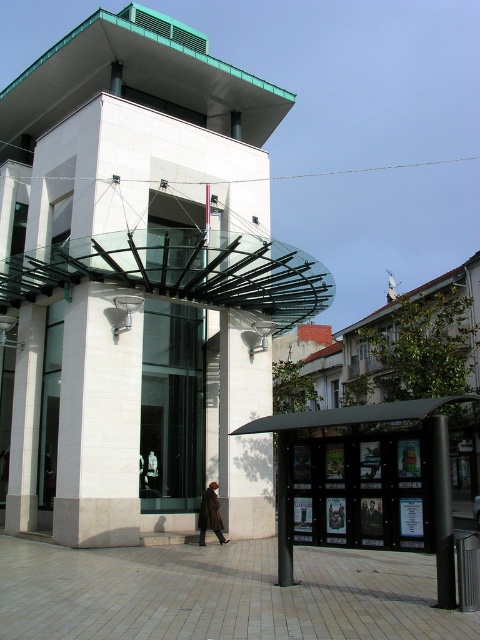
Question: Does white stone bell tower at center appear on the right side of white polished stone pillar at left?

Choices:
 (A) no
 (B) yes

Answer: (B)

Question: Can you confirm if white polished stone pillar at left is smaller than brown leather coat at center?

Choices:
 (A) yes
 (B) no

Answer: (A)

Question: Which of the following is the farthest from the observer?

Choices:
 (A) (265, 492)
 (B) (36, 372)
 (C) (206, 188)

Answer: (C)

Question: Which point is closer to the camera?

Choices:
 (A) white polished stone pillar at left
 (B) white stone bell tower at center
 (C) brown leather coat at center
 (D) white marble pillar at center

Answer: (B)

Question: Which object is the closest to the white marble pillar at center?

Choices:
 (A) white stone bell tower at center
 (B) white polished stone pillar at left
 (C) black metal pole at lower right

Answer: (B)

Question: Does black metal pole at lower right appear under brown leather coat at center?

Choices:
 (A) yes
 (B) no

Answer: (B)